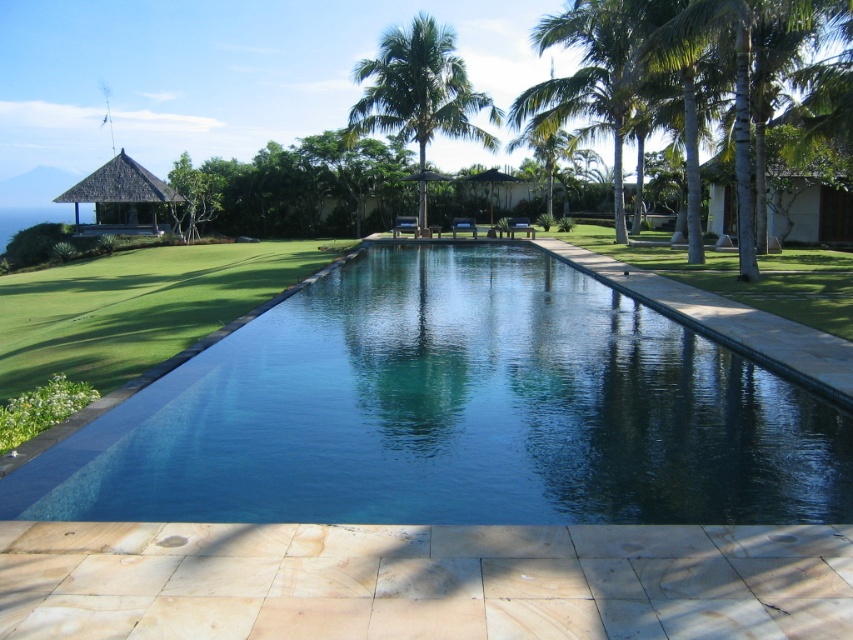
Who is more forward, [579,100] or [138,173]?

Point [579,100] is in front.

This screenshot has height=640, width=853. In order to click on green leafy palm tree at upper right in this screenshot , I will do `click(585, 83)`.

This screenshot has width=853, height=640. Identify the location of green leafy palm tree at upper right. (585, 83).

Can you confirm if thatched roof hut at upper left is positioned to the right of matte brown hut at center?

Incorrect, thatched roof hut at upper left is not on the right side of matte brown hut at center.

Does thatched roof hut at upper left have a greater width compared to matte brown hut at center?

Correct, the width of thatched roof hut at upper left exceeds that of matte brown hut at center.

Measure the distance between thatched roof hut at upper left and camera.

thatched roof hut at upper left and camera are 42.52 meters apart.

The image size is (853, 640). I want to click on thatched roof hut at upper left, so click(120, 198).

Is green leafy palm tree at upper right behind matte brown hut at center?

No, it is not.

Who is taller, green leafy palm tree at upper right or matte brown hut at center?

green leafy palm tree at upper right

Is point (631, 52) farther from viewer compared to point (488, 180)?

No.

This screenshot has width=853, height=640. I want to click on green leafy palm tree at upper right, so [585, 83].